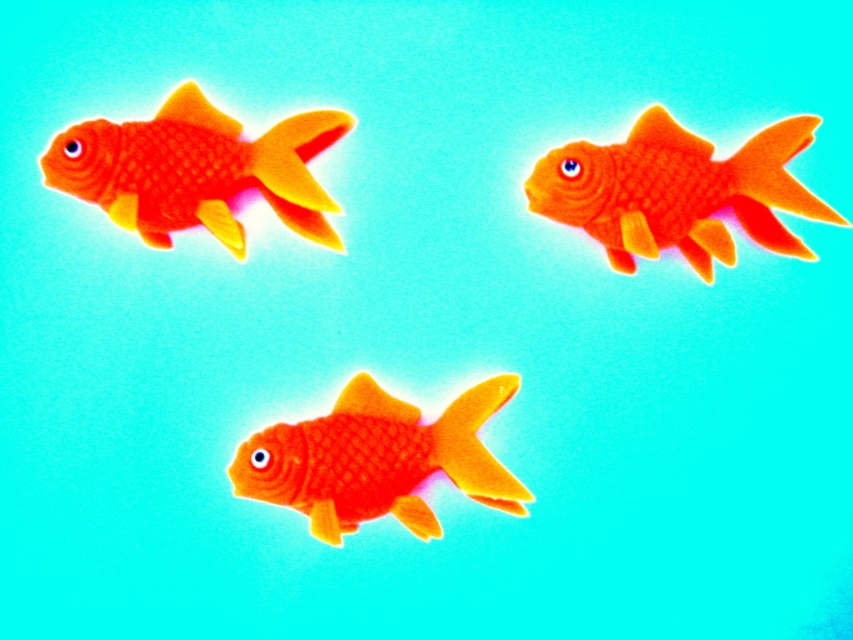
The image size is (853, 640). In order to click on matte orange goldfish at upper left in this screenshot , I will do `click(196, 170)`.

Who is positioned more to the left, matte orange goldfish at upper left or matte orange goldfish at center?

matte orange goldfish at upper left is more to the left.

Does point (184, 125) come behind point (349, 444)?

Yes, point (184, 125) is behind point (349, 444).

At what (x,y) coordinates should I click in order to perform the action: click on matte orange goldfish at upper left. Please return your answer as a coordinate pair (x, y). The image size is (853, 640). Looking at the image, I should click on (196, 170).

Which is more to the left, matte orange goldfish at upper right or matte orange goldfish at upper left?

Positioned to the left is matte orange goldfish at upper left.

Is matte orange goldfish at upper right below matte orange goldfish at upper left?

Indeed, matte orange goldfish at upper right is positioned under matte orange goldfish at upper left.

Which is behind, point (699, 273) or point (216, 209)?

Point (699, 273)

The image size is (853, 640). Identify the location of matte orange goldfish at upper right. (677, 192).

Is point (595, 220) in front of point (347, 481)?

That is False.

Does point (541, 173) come behind point (509, 387)?

No, it is in front of (509, 387).

Locate an element on the screen. The height and width of the screenshot is (640, 853). matte orange goldfish at upper right is located at coordinates (677, 192).